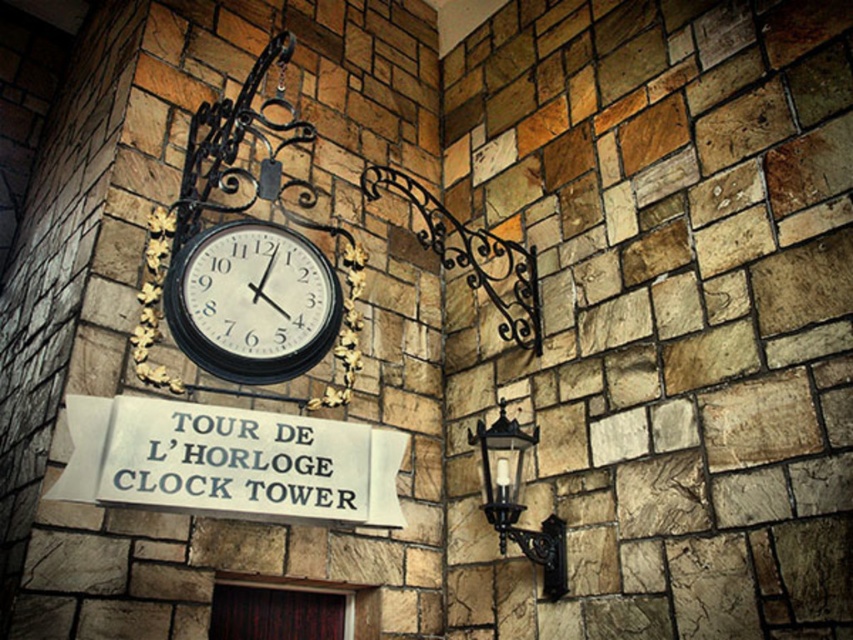
Does black glossy clock at center lie behind black wrought iron lamp at lower right?

No, black glossy clock at center is in front of black wrought iron lamp at lower right.

Is black glossy clock at center below black wrought iron lamp at lower right?

Incorrect, black glossy clock at center is not positioned below black wrought iron lamp at lower right.

Between point (260, 257) and point (514, 474), which one is positioned behind?

Positioned behind is point (260, 257).

You are a GUI agent. You are given a task and a screenshot of the screen. Output one action in this format:
    pyautogui.click(x=<x>, y=<y>)
    Task: Click on the black glossy clock at center
    The image size is (853, 640).
    Given the screenshot: What is the action you would take?
    pyautogui.click(x=251, y=301)

Is white metallic sign at center bigger than black wrought iron lamp at lower right?

Correct, white metallic sign at center is larger in size than black wrought iron lamp at lower right.

Is white metallic sign at center positioned behind black wrought iron lamp at lower right?

No.

Does point (151, 483) come closer to viewer compared to point (498, 452)?

Yes.

Find the location of a particular element. The image size is (853, 640). white metallic sign at center is located at coordinates (229, 461).

Does point (289, 445) come behind point (283, 248)?

No, it is not.

The width and height of the screenshot is (853, 640). I want to click on white metallic sign at center, so click(229, 461).